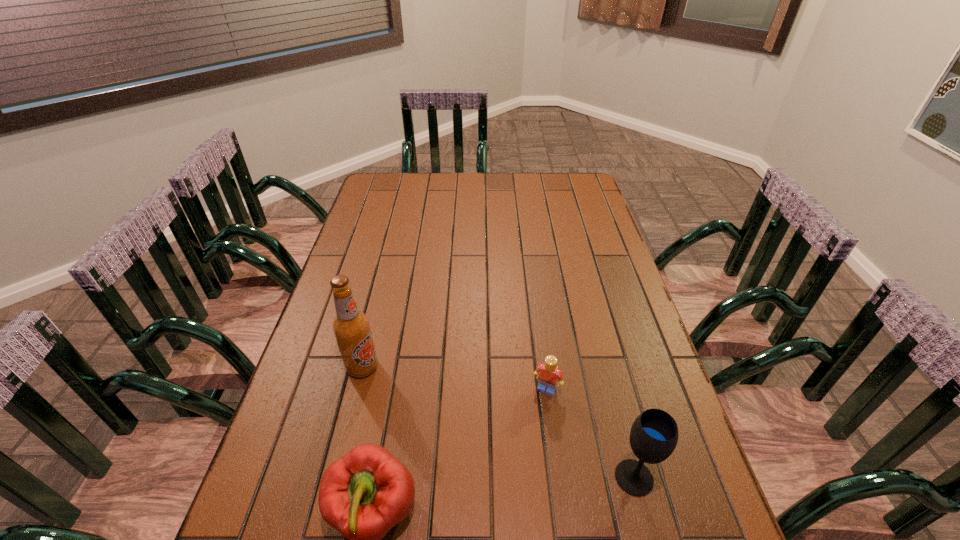
This screenshot has width=960, height=540. Find the location of `wineglass`. wineglass is located at coordinates (654, 434).

Where is `the third shortest object`? the third shortest object is located at coordinates (654, 434).

The image size is (960, 540). I want to click on the second object from right to left, so click(548, 373).

Find the location of a particular element. the shortest object is located at coordinates (548, 373).

Image resolution: width=960 pixels, height=540 pixels. I want to click on the tallest object, so click(x=351, y=327).

Image resolution: width=960 pixels, height=540 pixels. I want to click on free space located 0.050m on the back of the wineglass, so click(x=623, y=437).

The width and height of the screenshot is (960, 540). I want to click on vacant space situated on the front-facing side of the third object from left to right, so click(x=491, y=509).

Where is `vacant point located 0.130m on the front-facing side of the third object from left to right`? The height and width of the screenshot is (540, 960). vacant point located 0.130m on the front-facing side of the third object from left to right is located at coordinates (521, 441).

Locate an element on the screen. vacant space located on the front-facing side of the third object from left to right is located at coordinates (515, 457).

Locate an element on the screen. vacant point located on the front label of the beer bottle is located at coordinates (456, 441).